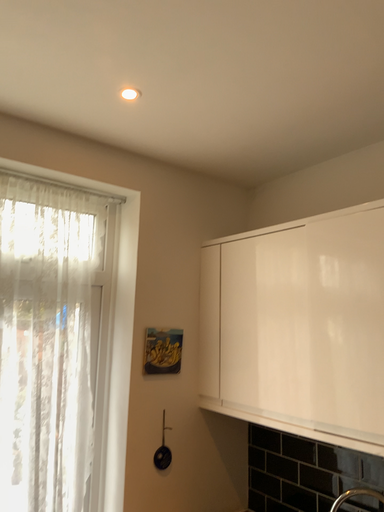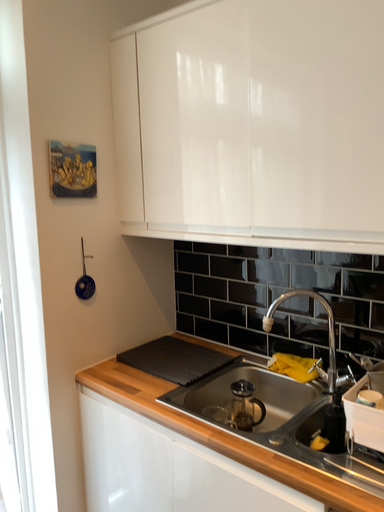
Question: Which way did the camera rotate in the video?

Choices:
 (A) rotated upward
 (B) rotated downward

Answer: (B)